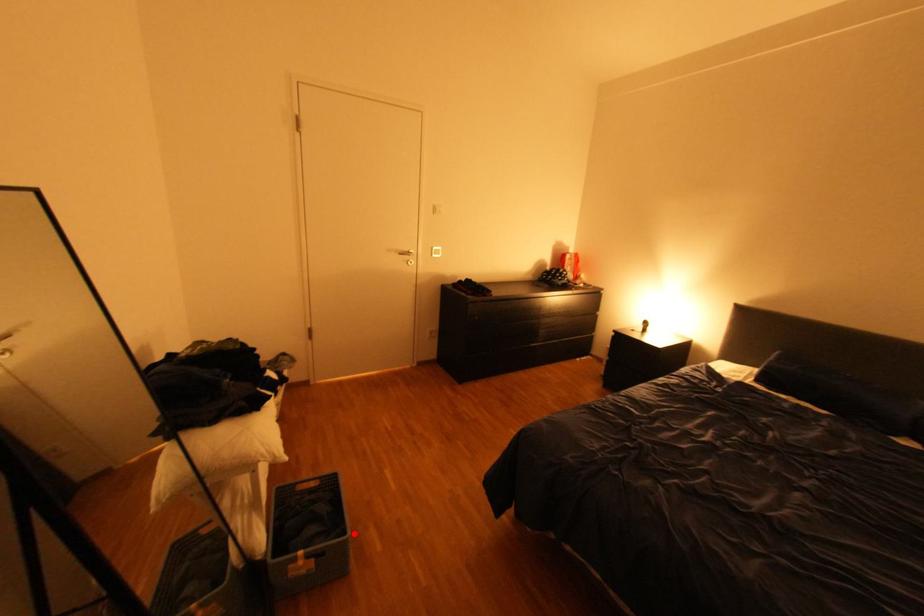
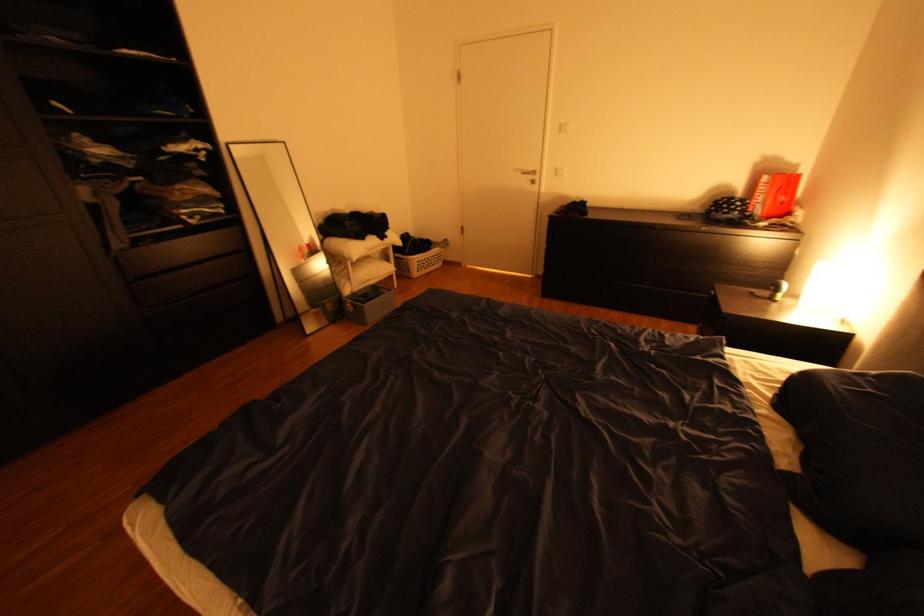
Question: A red point is marked in image1. In image2, is the corresponding 3D point closer to the camera or farther? Reply with the corresponding letter.

Choices:
 (A) The corresponding 3D point is closer.
 (B) The corresponding 3D point is farther.

Answer: (B)